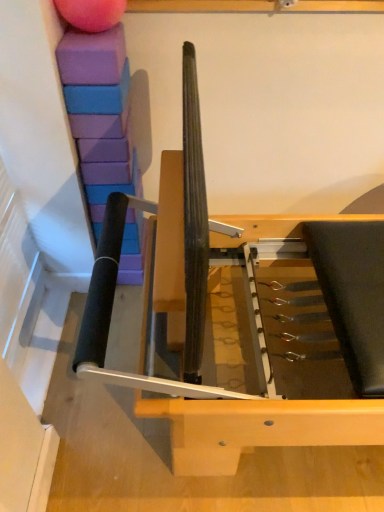
What do you see at coordinates (97, 98) in the screenshot?
I see `purple foam blocks at upper left` at bounding box center [97, 98].

What are the coordinates of `purple foam blocks at upper left` in the screenshot? It's located at (97, 98).

The width and height of the screenshot is (384, 512). Identify the location of purple foam blocks at upper left. (97, 98).